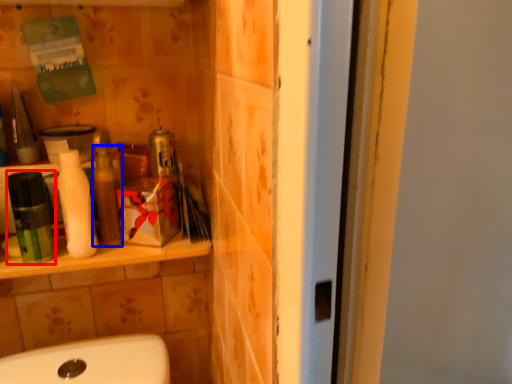
Question: Which object is further to the camera taking this photo, mouthwash (highlighted by a red box) or toiletry (highlighted by a blue box)?

Choices:
 (A) mouthwash
 (B) toiletry

Answer: (B)